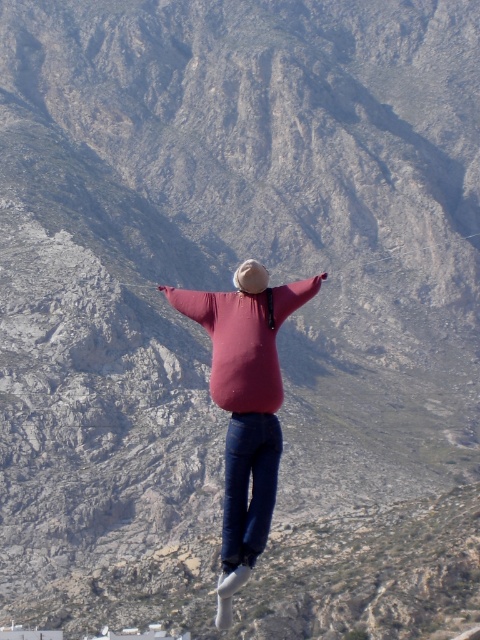
Based on the photo, is matte pink sweater at center bigger than blue denim jeans at center?

Correct, matte pink sweater at center is larger in size than blue denim jeans at center.

Consider the image. Can you confirm if matte pink sweater at center is positioned to the left of blue denim jeans at center?

Correct, you'll find matte pink sweater at center to the left of blue denim jeans at center.

You are a GUI agent. You are given a task and a screenshot of the screen. Output one action in this format:
    pyautogui.click(x=<x>, y=<y>)
    Task: Click on the matte pink sweater at center
    Image resolution: width=480 pixels, height=640 pixels.
    Given the screenshot: What is the action you would take?
    pyautogui.click(x=245, y=404)

At what (x,y) coordinates should I click in order to perform the action: click on matte pink sweater at center. Please return your answer as a coordinate pair (x, y). The image size is (480, 640). Looking at the image, I should click on (245, 404).